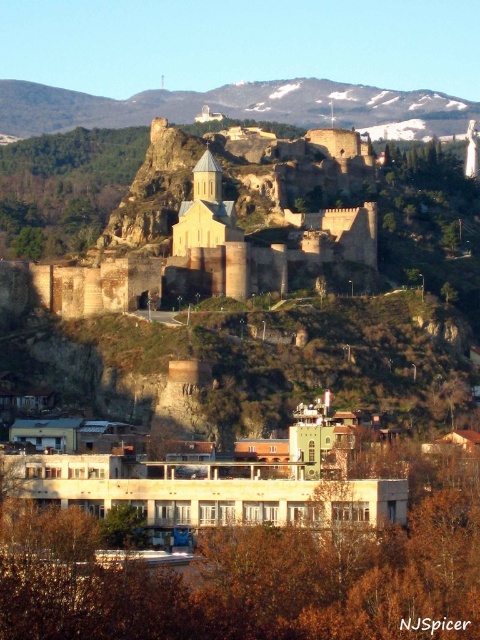
You are a tourist standing in the modern urban area looking towards the upper center of the image. You see the brown stone castle at upper center and the snowy rocky mountain at upper center. Which one appears bigger in the scene?

The brown stone castle at upper center appears bigger than the snowy rocky mountain at upper center because it has a larger size compared to it.

Looking at this image, you are a drone operator tasked with capturing aerial footage of the brown stone castle at upper center and the snowy rocky mountain at upper center. Your drone has a maximum flight range of 100 meters. Can you fly the drone from the castle to the mountain without exceeding its range?

The distance between the brown stone castle at upper center and the snowy rocky mountain at upper center is 83.16 meters, which is within the drone operator s 100 meter range. Therefore, the drone can safely fly from the castle to the mountain without exceeding its maximum flight range.